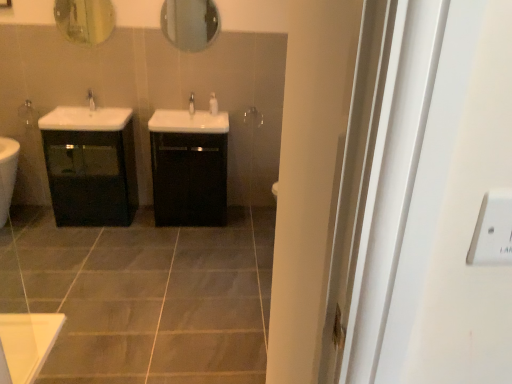
Find the location of a particular element. free space in front of black glossy cabinet at center, arranged as the 1th bathroom cabinet when viewed from the right is located at coordinates (180, 243).